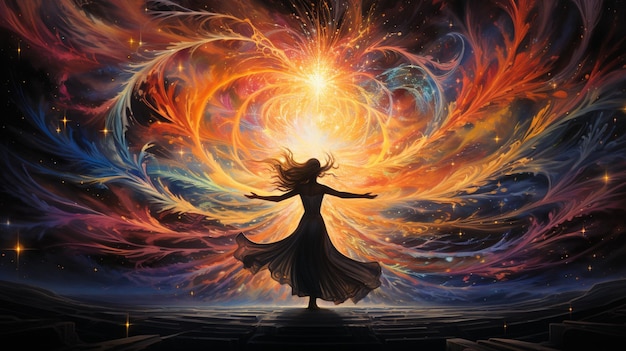
Find the location of a particular element. lights is located at coordinates (295, 83).